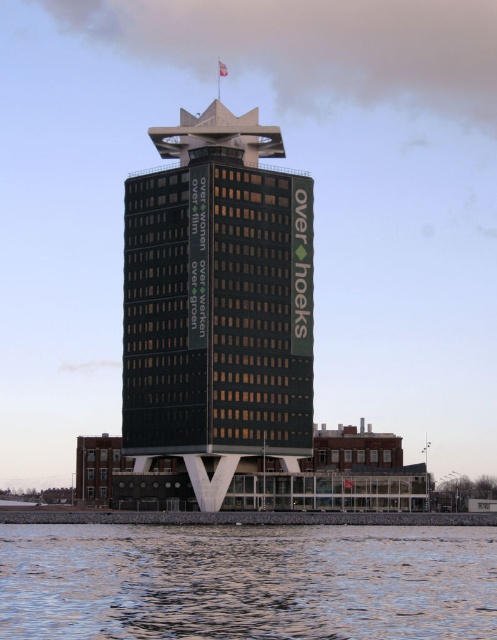
Is green glass building at center positioned in front of clear water at lower left?

No.

Between green glass building at center and clear water at lower left, which one has less height?

clear water at lower left is shorter.

Is point (244, 129) farther from viewer compared to point (118, 532)?

Yes, it is.

I want to click on green glass building at center, so click(x=218, y=304).